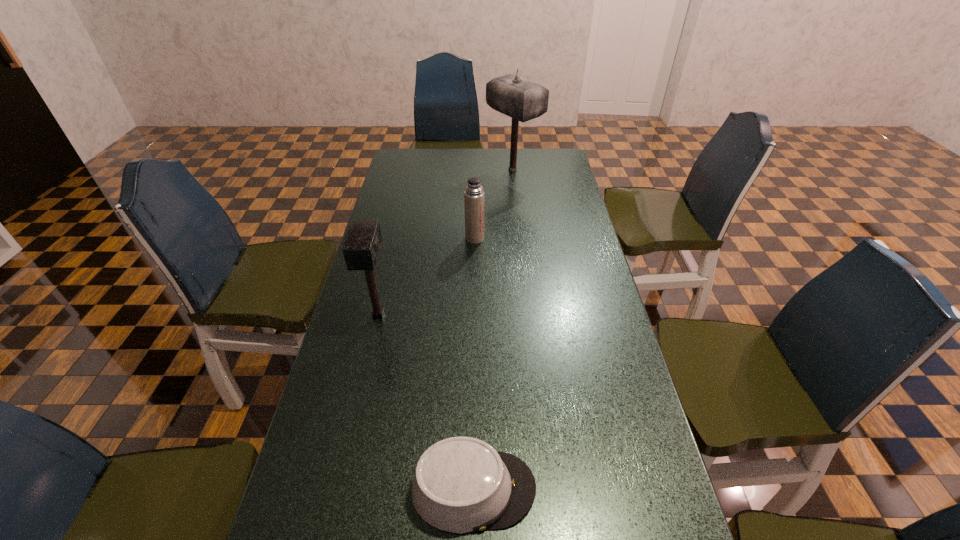
This screenshot has height=540, width=960. What are the coordinates of `free region located on the front of the third nearest object` in the screenshot? It's located at (474, 263).

Find the location of `vacant position located 0.050m on the front-facing side of the hat`. vacant position located 0.050m on the front-facing side of the hat is located at coordinates (561, 489).

Locate an element on the screen. object located at the far edge is located at coordinates (523, 100).

The height and width of the screenshot is (540, 960). In order to click on object at the left edge in this screenshot , I will do `click(362, 245)`.

In order to click on object that is at the right edge in this screenshot , I will do `click(523, 100)`.

Locate an element on the screen. Image resolution: width=960 pixels, height=540 pixels. object positioned at the far right corner is located at coordinates (523, 100).

In the image, there is a desktop. At what (x,y) coordinates should I click in order to perform the action: click on blank space at the far edge. Please return your answer as a coordinate pair (x, y). Image resolution: width=960 pixels, height=540 pixels. Looking at the image, I should click on (497, 165).

The image size is (960, 540). In the image, there is a desktop. Identify the location of vacant space at the left edge. (408, 178).

In the image, there is a desktop. Where is `vacant space at the right edge`? This screenshot has height=540, width=960. vacant space at the right edge is located at coordinates point(572,338).

Where is `free point at the far right corner`? The width and height of the screenshot is (960, 540). free point at the far right corner is located at coordinates (555, 152).